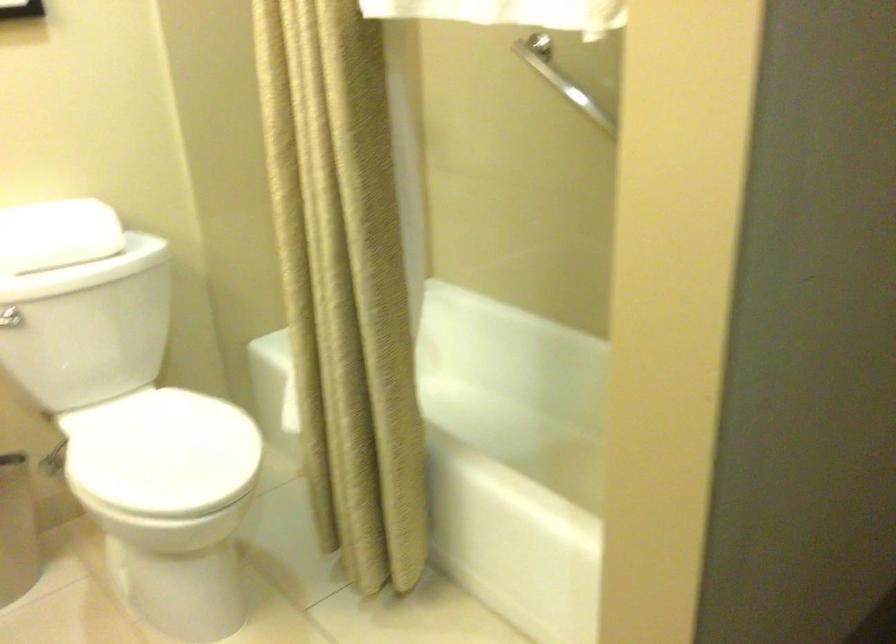
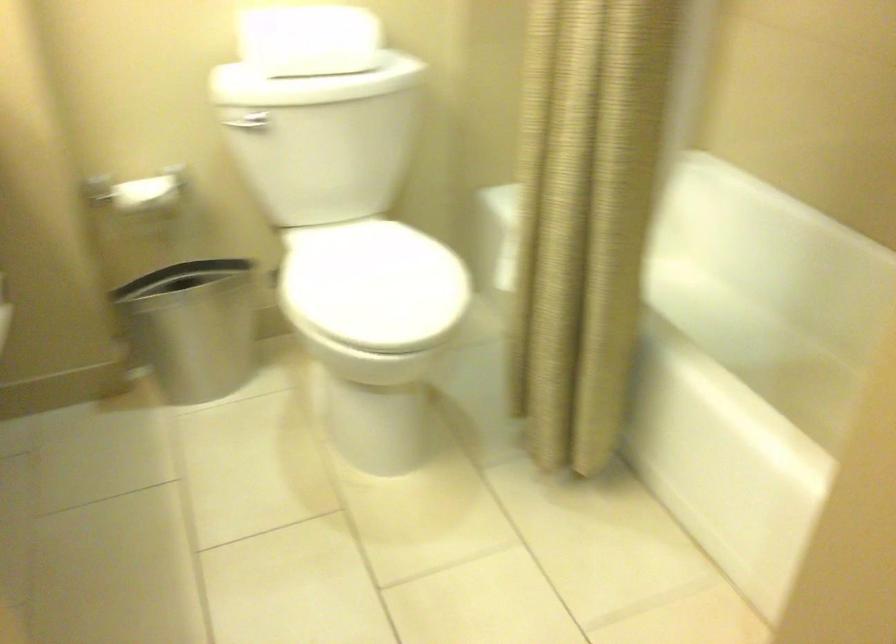
Find the pixel in the second image that matches the point at 165,456 in the first image.

(372, 285)